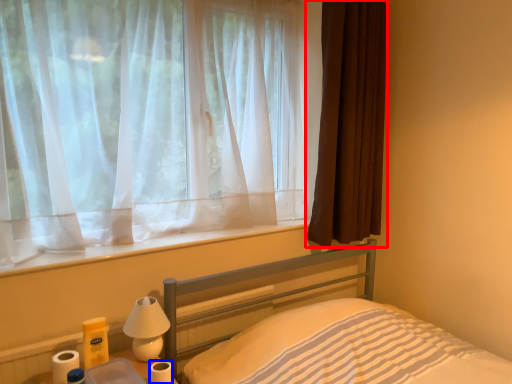
Question: Which object is closer to the camera taking this photo, curtain (highlighted by a red box) or toilet paper (highlighted by a blue box)?

Choices:
 (A) curtain
 (B) toilet paper

Answer: (B)